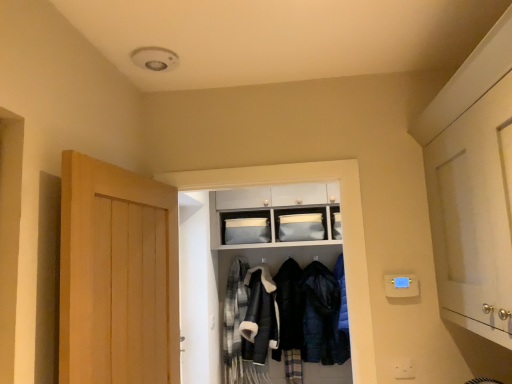
Question: Is matte gray fabric storage at upper center a part of leather jacket at center, marked as the second clothing in a left-to-right arrangement?

Choices:
 (A) yes
 (B) no

Answer: (B)

Question: Could you tell me if leather jacket at center, arranged as the 3th clothing when viewed from the right, is facing matte gray fabric storage at upper center?

Choices:
 (A) yes
 (B) no

Answer: (B)

Question: Considering the relative sizes of leather jacket at center, arranged as the 3th clothing when viewed from the right, and matte gray fabric storage at upper center in the image provided, is leather jacket at center, arranged as the 3th clothing when viewed from the right, wider than matte gray fabric storage at upper center?

Choices:
 (A) yes
 (B) no

Answer: (A)

Question: From a real-world perspective, is leather jacket at center, marked as the second clothing in a left-to-right arrangement, located higher than matte gray fabric storage at upper center?

Choices:
 (A) yes
 (B) no

Answer: (B)

Question: Is the position of leather jacket at center, arranged as the 3th clothing when viewed from the right, less distant than that of matte gray fabric storage at upper center?

Choices:
 (A) no
 (B) yes

Answer: (B)

Question: In terms of width, does white glossy cabinet at right, placed as the 2th door when sorted from left to right, look wider or thinner when compared to white fabric coat at center?

Choices:
 (A) thin
 (B) wide

Answer: (A)

Question: Is white glossy cabinet at right, positioned as the first door in right-to-left order, to the left or to the right of white fabric coat at center in the image?

Choices:
 (A) left
 (B) right

Answer: (B)

Question: Is white glossy cabinet at right, placed as the 2th door when sorted from left to right, inside the boundaries of white fabric coat at center, or outside?

Choices:
 (A) inside
 (B) outside

Answer: (B)

Question: In terms of height, does white glossy cabinet at right, positioned as the first door in right-to-left order, look taller or shorter compared to white fabric coat at center?

Choices:
 (A) short
 (B) tall

Answer: (A)

Question: Is white glossy cabinet at right, positioned as the first door in right-to-left order, to the left or to the right of dark blue quilted jacket at center, the 1th clothing in the right-to-left sequence, in the image?

Choices:
 (A) left
 (B) right

Answer: (B)

Question: In terms of width, does white glossy cabinet at right, positioned as the first door in right-to-left order, look wider or thinner when compared to dark blue quilted jacket at center, which is the fourth clothing in left-to-right order?

Choices:
 (A) thin
 (B) wide

Answer: (B)

Question: Based on their sizes in the image, would you say white glossy cabinet at right, placed as the 2th door when sorted from left to right, is bigger or smaller than dark blue quilted jacket at center, which is the fourth clothing in left-to-right order?

Choices:
 (A) small
 (B) big

Answer: (B)

Question: From a real-world perspective, is white glossy cabinet at right, placed as the 2th door when sorted from left to right, positioned above or below dark blue quilted jacket at center, the 1th clothing in the right-to-left sequence?

Choices:
 (A) below
 (B) above

Answer: (B)

Question: Relative to matte gray fabric storage at upper center, is light brown wooden door at left, the first door when ordered from left to right, in front or behind?

Choices:
 (A) behind
 (B) front

Answer: (B)

Question: In terms of height, does light brown wooden door at left, the first door when ordered from left to right, look taller or shorter compared to matte gray fabric storage at upper center?

Choices:
 (A) tall
 (B) short

Answer: (A)